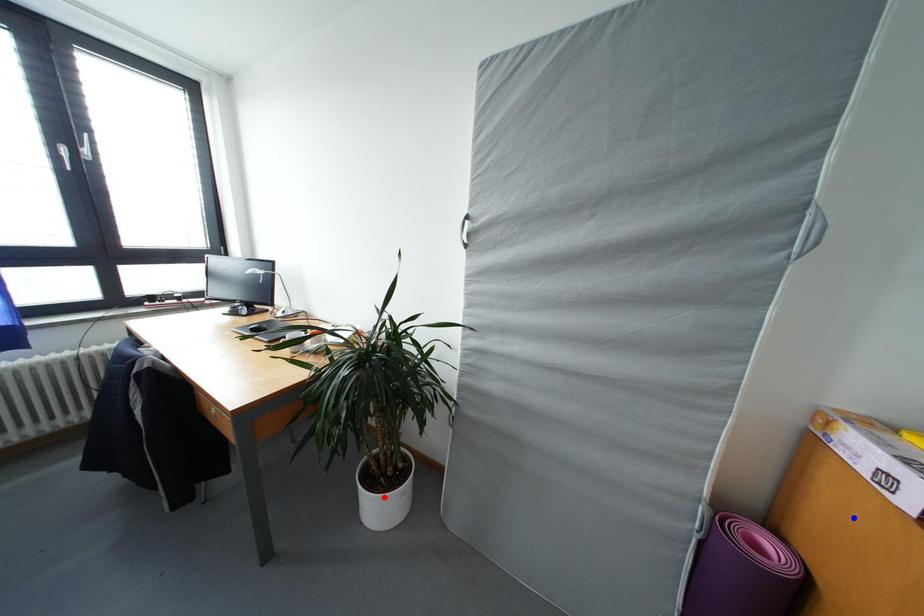
Question: In the image, two points are highlighted. Which point is nearer to the camera? Reply with the corresponding letter.

Choices:
 (A) blue point
 (B) red point

Answer: (A)